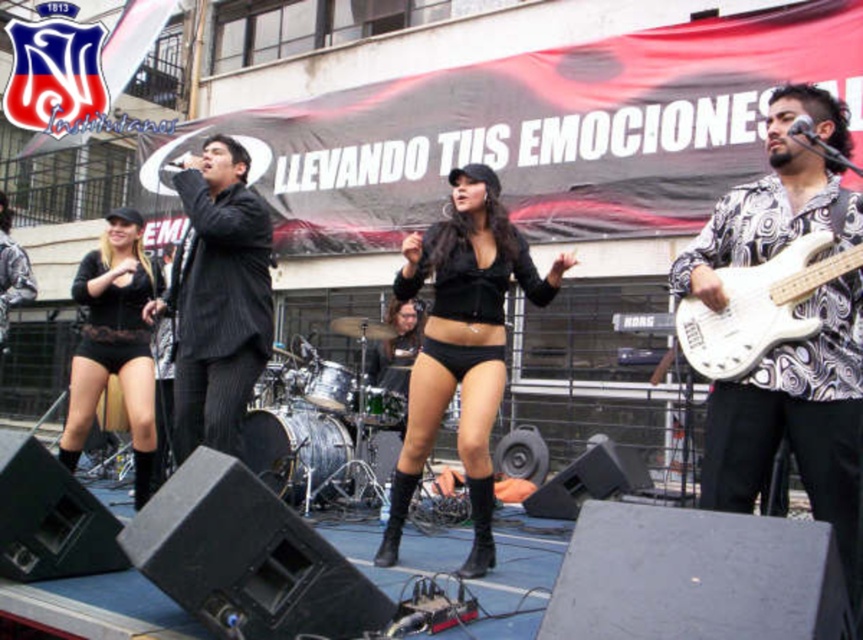
Can you confirm if black matte shorts at center is bigger than black pinstripe suit at center?

Incorrect, black matte shorts at center is not larger than black pinstripe suit at center.

Between point (438, 230) and point (215, 365), which one is positioned behind?

Positioned behind is point (438, 230).

Is point (448, 339) positioned in front of point (244, 352)?

Yes, point (448, 339) is closer to viewer.

Locate an element on the screen. This screenshot has width=863, height=640. black matte shorts at center is located at coordinates (463, 346).

Which is in front, point (231, 385) or point (816, 291)?

Point (816, 291)

Can you confirm if black pinstripe suit at center is taller than white glossy electric guitar at right?

Yes, black pinstripe suit at center is taller than white glossy electric guitar at right.

Who is more forward, (180,266) or (723,310)?

Point (723,310)

In order to click on black pinstripe suit at center in this screenshot , I will do `click(217, 298)`.

Between black matte shorts at center and black lace shorts at lower left, which one has less height?

black lace shorts at lower left is shorter.

How far apart are black matte shorts at center and black lace shorts at lower left?

10.97 feet

Describe the element at coordinates (463, 346) in the screenshot. I see `black matte shorts at center` at that location.

The width and height of the screenshot is (863, 640). In order to click on black matte shorts at center in this screenshot , I will do pos(463,346).